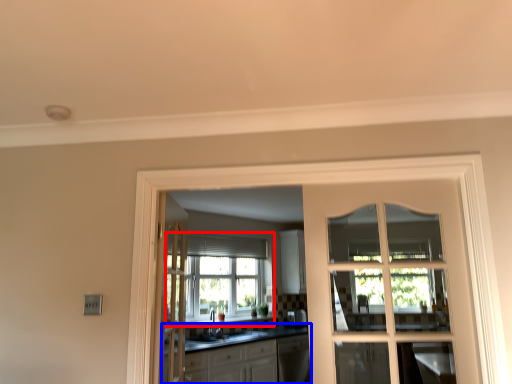
Question: Which object appears closest to the camera in this image, window (highlighted by a red box) or cabinetry (highlighted by a blue box)?

Choices:
 (A) window
 (B) cabinetry

Answer: (B)